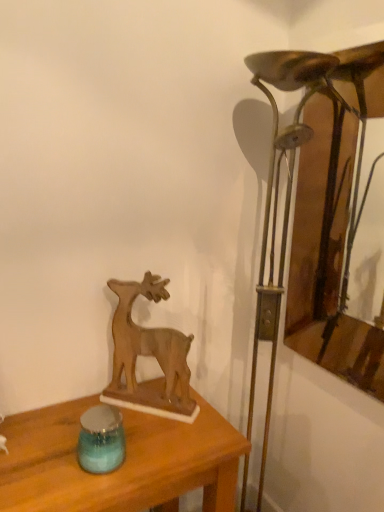
What do you see at coordinates (334, 227) in the screenshot?
I see `wooden frame at right` at bounding box center [334, 227].

Image resolution: width=384 pixels, height=512 pixels. In order to click on blue glass candle holder at lower left in this screenshot , I will do `click(101, 440)`.

The height and width of the screenshot is (512, 384). What are the coordinates of `bronze metallic table lamp at right` in the screenshot? It's located at (286, 193).

What do you see at coordinates (286, 193) in the screenshot? I see `bronze metallic table lamp at right` at bounding box center [286, 193].

This screenshot has width=384, height=512. Describe the element at coordinates (123, 463) in the screenshot. I see `wooden table at center` at that location.

You are a GUI agent. You are given a task and a screenshot of the screen. Output one action in this format:
    pyautogui.click(x=<x>, y=<y>)
    Task: Click on the wooden deer at center
    This screenshot has width=384, height=512.
    Given the screenshot: What is the action you would take?
    pyautogui.click(x=148, y=340)

Identify the location of wooden frame at right. This screenshot has width=384, height=512. (334, 227).

Considering the relative sizes of blue glass candle holder at lower left and wooden frame at right in the image provided, is blue glass candle holder at lower left shorter than wooden frame at right?

Yes, blue glass candle holder at lower left is shorter than wooden frame at right.

Who is smaller, blue glass candle holder at lower left or wooden frame at right?

blue glass candle holder at lower left is smaller.

Measure the distance between blue glass candle holder at lower left and wooden frame at right.

A distance of 3.78 feet exists between blue glass candle holder at lower left and wooden frame at right.

Is blue glass candle holder at lower left oriented towards wooden frame at right?

No, blue glass candle holder at lower left does not turn towards wooden frame at right.

Is wooden frame at right to the left of wooden table at center from the viewer's perspective?

Incorrect, wooden frame at right is not on the left side of wooden table at center.

This screenshot has width=384, height=512. I want to click on table below the wooden frame at right (from a real-world perspective), so click(123, 463).

Is wooden frame at right in front of or behind wooden table at center in the image?

Clearly, wooden frame at right is behind wooden table at center.

From a real-world perspective, which object rests below the other?

In real-world perspective, wooden table at center is lower.

Is the position of wooden table at center less distant than that of blue glass candle holder at lower left?

Yes, it is in front of blue glass candle holder at lower left.

Which of these two, wooden table at center or blue glass candle holder at lower left, is thinner?

With smaller width is blue glass candle holder at lower left.

Is wooden table at center positioned with its back to blue glass candle holder at lower left?

No, wooden table at center's orientation is not away from blue glass candle holder at lower left.

Is wooden table at center with blue glass candle holder at lower left?

No, wooden table at center is not with blue glass candle holder at lower left.

Between point (254, 382) and point (206, 417), which one is positioned in front?

The point (206, 417) is closer.

Based on the photo, how many degrees apart are the facing directions of bronze metallic table lamp at right and wooden table at center?

They differ by 0.000944 degrees in their facing directions.

Choose the correct answer: Is bronze metallic table lamp at right inside wooden table at center or outside it?

bronze metallic table lamp at right is located beyond the bounds of wooden table at center.

Identify the location of deer that appears above the wooden table at center (from a real-world perspective). (148, 340).

Considering the relative sizes of wooden deer at center and wooden table at center in the image provided, is wooden deer at center bigger than wooden table at center?

No, wooden deer at center is not bigger than wooden table at center.

Is wooden deer at center oriented towards wooden table at center?

No, wooden deer at center is not turned towards wooden table at center.

From the image's perspective, which object appears higher, wooden deer at center or wooden table at center?

From the image's view, wooden deer at center is above.

What are the coordinates of `table below the wooden frame at right (from the image's perspective)` in the screenshot? It's located at (123, 463).

Considering the sizes of wooden table at center and wooden frame at right in the image, is wooden table at center taller or shorter than wooden frame at right?

Clearly, wooden table at center is shorter compared to wooden frame at right.

Looking at this image, in terms of width, does wooden table at center look wider or thinner when compared to wooden frame at right?

Considering their sizes, wooden table at center looks broader than wooden frame at right.

From the image's perspective, does wooden table at center appear higher than wooden frame at right?

No.

Is blue glass candle holder at lower left completely or partially inside wooden deer at center?

No, wooden deer at center does not contain blue glass candle holder at lower left.

Image resolution: width=384 pixels, height=512 pixels. I want to click on deer behind the blue glass candle holder at lower left, so click(148, 340).

From the picture: Which of these two, wooden deer at center or blue glass candle holder at lower left, is bigger?

With larger size is wooden deer at center.

Which of these two, wooden deer at center or blue glass candle holder at lower left, is wider?

blue glass candle holder at lower left.

At what (x,y) coordinates should I click in order to perform the action: click on picture frame that appears on the right of blue glass candle holder at lower left. Please return your answer as a coordinate pair (x, y). This screenshot has height=512, width=384. Looking at the image, I should click on (334, 227).

The width and height of the screenshot is (384, 512). In order to click on picture frame lying behind the wooden table at center in this screenshot , I will do `click(334, 227)`.

Considering their positions, is blue glass candle holder at lower left positioned further to wooden deer at center than bronze metallic table lamp at right?

bronze metallic table lamp at right lies further to wooden deer at center than the other object.

Considering their positions, is blue glass candle holder at lower left positioned further to wooden table at center than wooden deer at center?

Based on the image, wooden deer at center appears to be further to wooden table at center.

Based on the photo, estimate the real-world distances between objects in this image. Which object is further from bronze metallic table lamp at right, wooden frame at right or wooden table at center?

The object further to bronze metallic table lamp at right is wooden table at center.

Which object lies further to the anchor point blue glass candle holder at lower left, wooden frame at right or bronze metallic table lamp at right?

wooden frame at right is further to blue glass candle holder at lower left.

In the scene shown: Estimate the real-world distances between objects in this image. Which object is closer to wooden deer at center, wooden table at center or blue glass candle holder at lower left?

Among the two, wooden table at center is located nearer to wooden deer at center.

Consider the image. Which object lies further to the anchor point wooden frame at right, bronze metallic table lamp at right or wooden deer at center?

Among the two, wooden deer at center is located further to wooden frame at right.

From the image, which object appears to be nearer to blue glass candle holder at lower left, wooden table at center or wooden frame at right?

wooden table at center lies closer to blue glass candle holder at lower left than the other object.

Based on their spatial positions, is wooden deer at center or bronze metallic table lamp at right further from blue glass candle holder at lower left?

Among the two, bronze metallic table lamp at right is located further to blue glass candle holder at lower left.

Where is `table situated between blue glass candle holder at lower left and bronze metallic table lamp at right from left to right`? This screenshot has width=384, height=512. table situated between blue glass candle holder at lower left and bronze metallic table lamp at right from left to right is located at coordinates (123, 463).

The height and width of the screenshot is (512, 384). Find the location of `table lamp between wooden deer at center and wooden frame at right from left to right`. table lamp between wooden deer at center and wooden frame at right from left to right is located at coordinates (286, 193).

This screenshot has height=512, width=384. I want to click on candle holder between wooden frame at right and wooden table at center in the up-down direction, so click(101, 440).

Image resolution: width=384 pixels, height=512 pixels. I want to click on deer located between blue glass candle holder at lower left and wooden frame at right in the left-right direction, so [x=148, y=340].